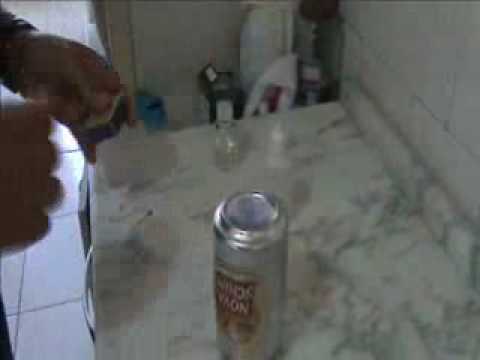
Find the location of `seams seperating tiles`. seams seperating tiles is located at coordinates (20, 279), (16, 324).